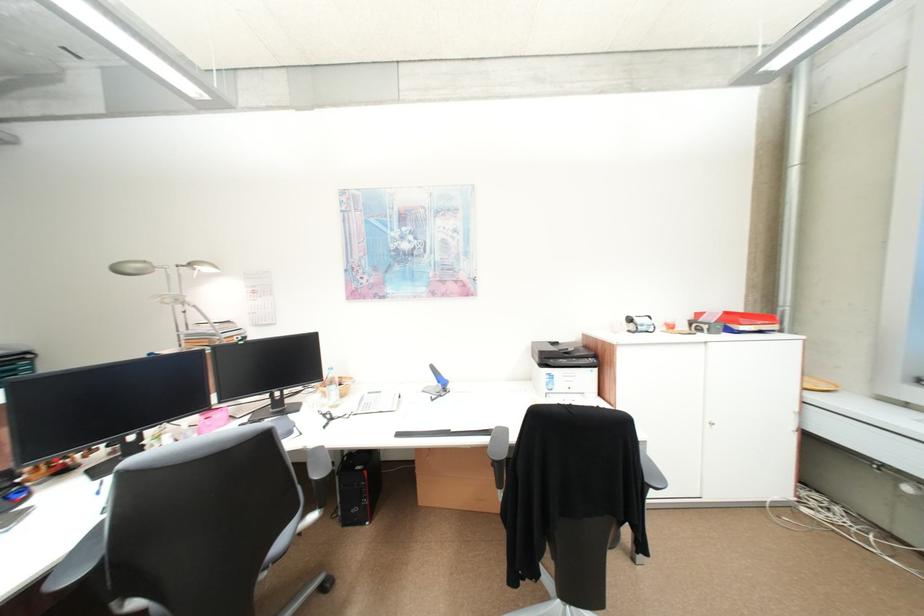
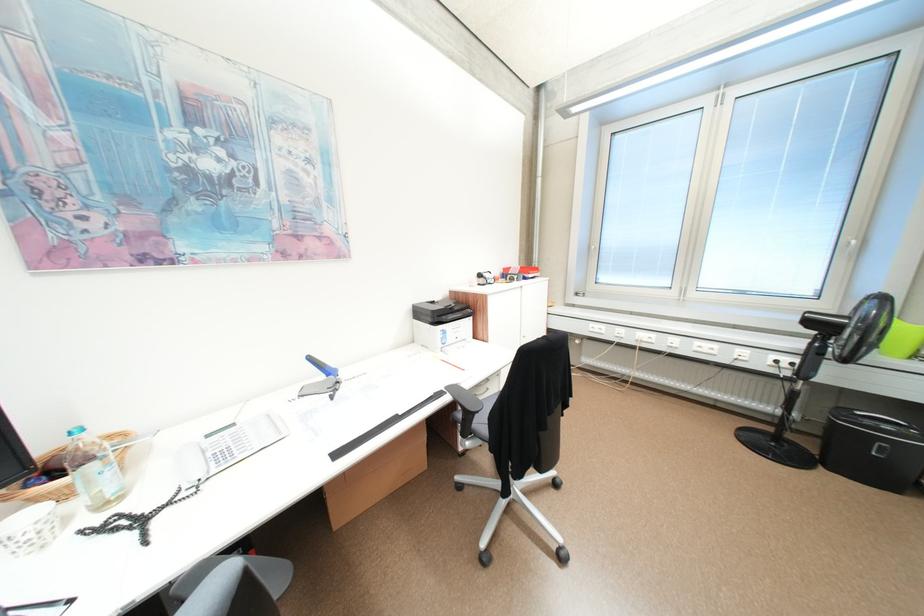
The point at (x=442, y=368) is marked in the first image. Where is the corresponding point in the second image?

(320, 359)